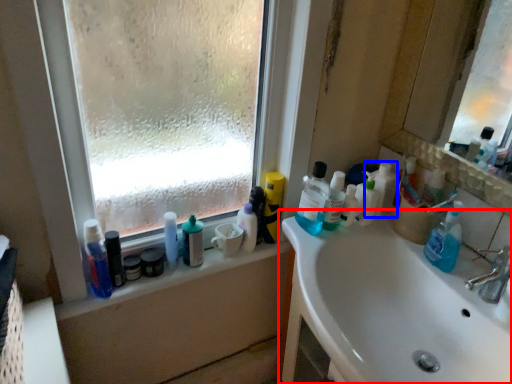
Question: Which point is closer to the camera, bathroom cabinet (highlighted by a red box) or cleaning product (highlighted by a blue box)?

Choices:
 (A) bathroom cabinet
 (B) cleaning product

Answer: (A)